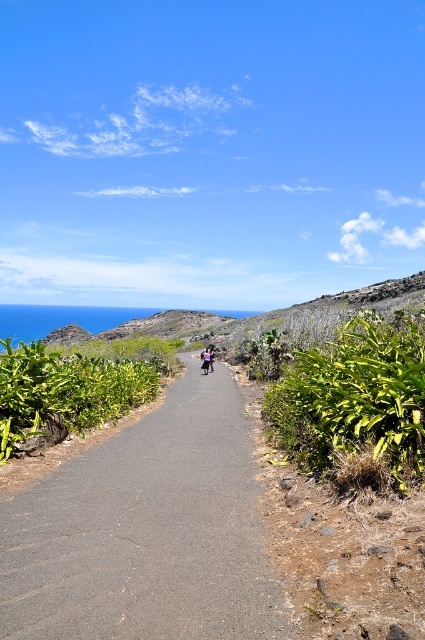
Question: Which point is closer to the camera taking this photo?

Choices:
 (A) (82, 392)
 (B) (164, 632)

Answer: (B)

Question: Does dark asphalt path at center have a larger size compared to green leafy shrub at right?

Choices:
 (A) yes
 (B) no

Answer: (B)

Question: Considering the real-world distances, which object is closest to the green leafy shrub at center-left?

Choices:
 (A) dark asphalt path at center
 (B) green leafy shrub at right

Answer: (A)

Question: Is the position of green leafy shrub at right more distant than that of green leafy shrub at center-left?

Choices:
 (A) no
 (B) yes

Answer: (A)

Question: Is dark asphalt path at center closer to camera compared to green leafy shrub at right?

Choices:
 (A) no
 (B) yes

Answer: (B)

Question: Which is nearer to the dark asphalt path at center?

Choices:
 (A) green leafy shrub at right
 (B) green leafy shrub at center-left

Answer: (A)